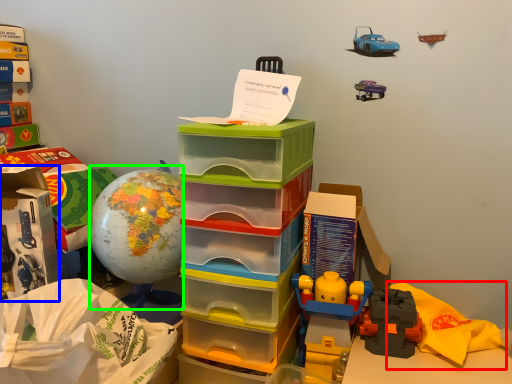
Question: Which is nearer to the material (highlighted by a red box)? storage box (highlighted by a blue box) or toy (highlighted by a green box).

Choices:
 (A) storage box
 (B) toy

Answer: (B)